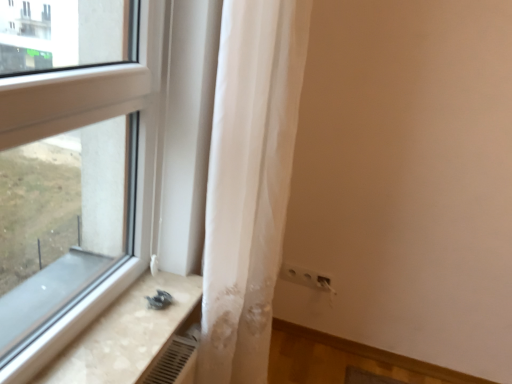
Question: Could you tell me if white sheer curtain at center is facing beige marble counter top at lower left?

Choices:
 (A) no
 (B) yes

Answer: (A)

Question: Is white sheer curtain at center in front of beige marble counter top at lower left?

Choices:
 (A) no
 (B) yes

Answer: (B)

Question: Is white sheer curtain at center to the right of beige marble counter top at lower left from the viewer's perspective?

Choices:
 (A) yes
 (B) no

Answer: (A)

Question: Considering the relative sizes of white sheer curtain at center and beige marble counter top at lower left in the image provided, is white sheer curtain at center thinner than beige marble counter top at lower left?

Choices:
 (A) yes
 (B) no

Answer: (A)

Question: From the image's perspective, is white sheer curtain at center beneath beige marble counter top at lower left?

Choices:
 (A) yes
 (B) no

Answer: (B)

Question: Considering their positions, is beige marble counter top at lower left located in front of or behind white sheer curtain at center?

Choices:
 (A) behind
 (B) front

Answer: (A)

Question: Is beige marble counter top at lower left spatially inside white sheer curtain at center, or outside of it?

Choices:
 (A) outside
 (B) inside

Answer: (A)

Question: In terms of size, does beige marble counter top at lower left appear bigger or smaller than white sheer curtain at center?

Choices:
 (A) big
 (B) small

Answer: (B)

Question: Considering the positions of beige marble counter top at lower left and white sheer curtain at center in the image, is beige marble counter top at lower left wider or thinner than white sheer curtain at center?

Choices:
 (A) thin
 (B) wide

Answer: (B)

Question: Is point (285, 269) closer or farther from the camera than point (206, 294)?

Choices:
 (A) farther
 (B) closer

Answer: (A)

Question: Considering the positions of white plastic electric outlet at lower right and white sheer curtain at center in the image, is white plastic electric outlet at lower right wider or thinner than white sheer curtain at center?

Choices:
 (A) wide
 (B) thin

Answer: (B)

Question: Is white plastic electric outlet at lower right inside or outside of white sheer curtain at center?

Choices:
 (A) inside
 (B) outside

Answer: (B)

Question: Considering the relative positions of white plastic electric outlet at lower right and white sheer curtain at center in the image provided, is white plastic electric outlet at lower right to the left or to the right of white sheer curtain at center?

Choices:
 (A) left
 (B) right

Answer: (B)

Question: Is beige marble counter top at lower left to the left or to the right of white plastic electric outlet at lower right in the image?

Choices:
 (A) right
 (B) left

Answer: (B)

Question: From the image's perspective, is beige marble counter top at lower left positioned above or below white plastic electric outlet at lower right?

Choices:
 (A) below
 (B) above

Answer: (B)